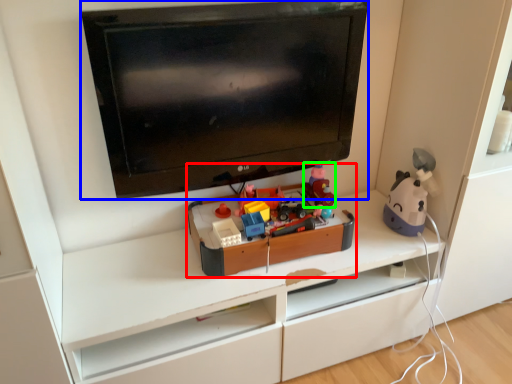
Question: Which is nearer to the toy (highlighted by a red box)? television (highlighted by a blue box) or toy (highlighted by a green box).

Choices:
 (A) television
 (B) toy

Answer: (B)